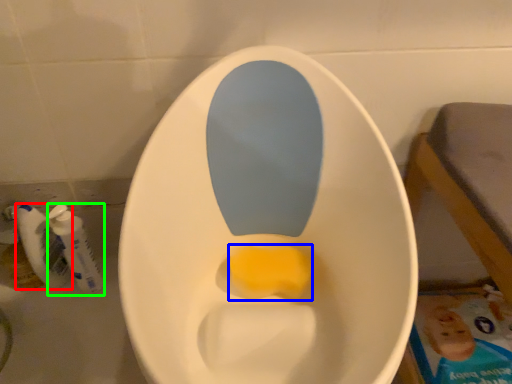
Question: Which object is the farthest from mouthwash (highlighted by a red box)? Choose among these: food (highlighted by a blue box) or mouthwash (highlighted by a green box).

Choices:
 (A) food
 (B) mouthwash

Answer: (A)